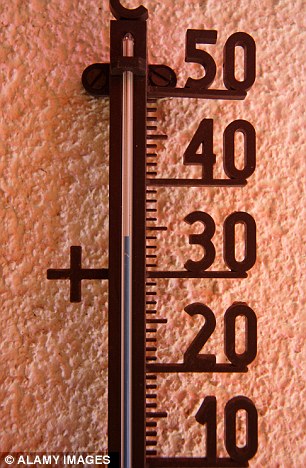
Image resolution: width=306 pixels, height=468 pixels. Find the location of `hook`. hook is located at coordinates (113, 6).